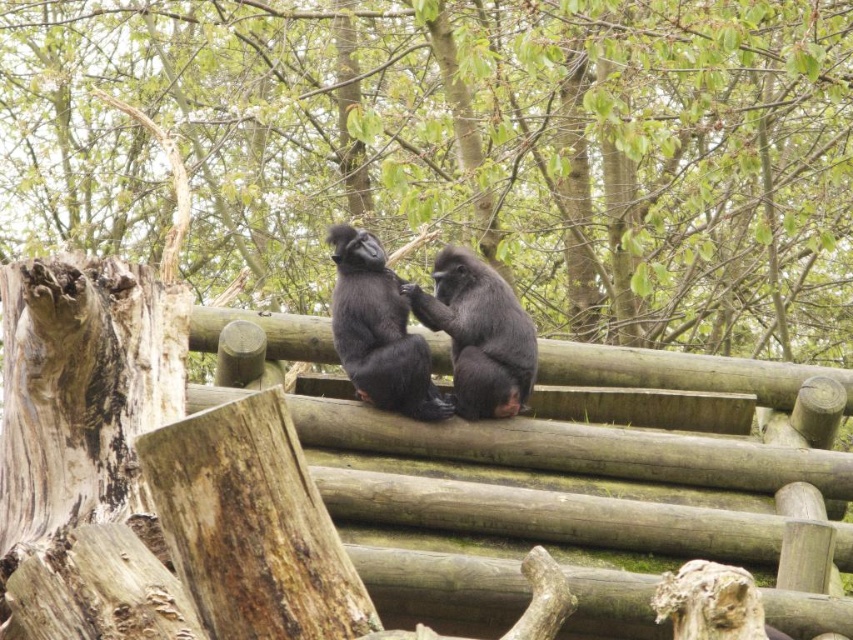
Consider the image. You are a zookeeper observing two monkeys in their enclosure. You notice a shiny black monkey at center and a black fur monkey at center. Which monkey is shorter in height?

The shiny black monkey at center has a lesser height compared to the black fur monkey at center, so the shiny black monkey at center is shorter.

You are a zookeeper planning to place a feeding tray between the smooth bark tree trunk at left and the black fur monkey at center. Considering their widths, which object should you position the feeding tray closer to to ensure it doesn

The smooth bark tree trunk at left is wider than the black fur monkey at center. To ensure the feeding tray is placed closer to the wider object, position it near the smooth bark tree trunk at left.

You are a zookeeper trying to observe the two monkeys in the enclosure. Which monkey is closer to you, the shiny black monkey at center or the black fur monkey at center?

The shiny black monkey at center is closer to you because it is positioned further to the viewer than the black fur monkey at center.